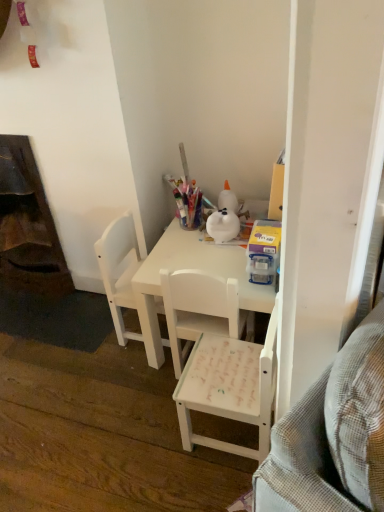
Locate an element on the screen. vacant space in white matte chair at center, which is the 3th chair in left-to-right order (from a real-world perspective) is located at coordinates (224, 434).